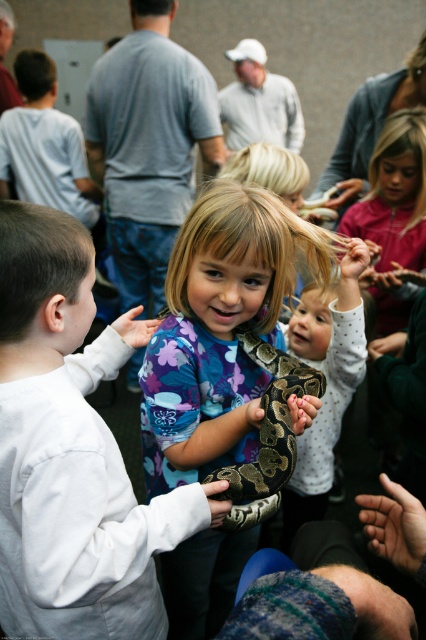
Can you confirm if white soft shirt at center is wider than brown patterned snake at center?

Yes, white soft shirt at center is wider than brown patterned snake at center.

Is point (166, 536) positioned before point (282, 372)?

Yes.

The width and height of the screenshot is (426, 640). I want to click on white soft shirt at center, so click(x=71, y=451).

In order to click on patterned dark green snake at center in this screenshot , I will do `click(328, 384)`.

Describe the element at coordinates (328, 384) in the screenshot. This screenshot has width=426, height=640. I see `patterned dark green snake at center` at that location.

Measure the distance between point (330, 385) and camera.

Point (330, 385) is 5.98 feet away from camera.

At what (x,y) coordinates should I click in order to perform the action: click on patterned dark green snake at center. Please return your answer as a coordinate pair (x, y). Looking at the image, I should click on (328, 384).

This screenshot has height=640, width=426. I want to click on floral-patterned shirt at center, so click(x=218, y=330).

Between floral-patterned shirt at center and brown patterned snake at center, which one is positioned higher?

brown patterned snake at center is higher up.

Who is more forward, (207, 394) or (301, 396)?

Positioned in front is point (301, 396).

The width and height of the screenshot is (426, 640). What are the coordinates of `floral-patterned shirt at center` in the screenshot? It's located at (218, 330).